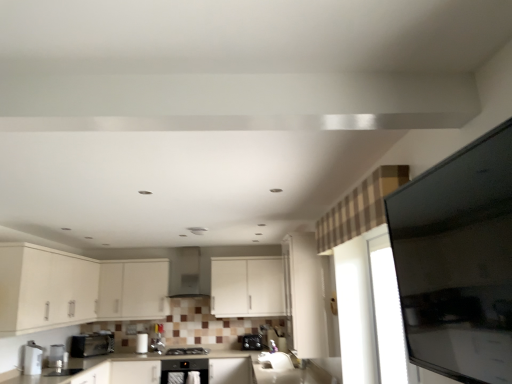
Where is `satin silver toaster at center, acting as the fifth appliance starting from the front`? The image size is (512, 384). satin silver toaster at center, acting as the fifth appliance starting from the front is located at coordinates (276, 338).

Based on the photo, measure the distance between satin black microwave at lower left, the first home appliance when ordered from left to right, and camera.

The distance of satin black microwave at lower left, the first home appliance when ordered from left to right, from camera is 5.02 meters.

Locate an element on the screen. The height and width of the screenshot is (384, 512). matte white cabinet at center, which is the second cabinetry from left to right is located at coordinates pos(133,289).

Which is closer to the camera, (379,268) or (186,359)?

Point (379,268) is positioned closer to the camera compared to point (186,359).

How far apart are transparent glass door at right and satin black oven at center, which is the first home appliance from right to left?

3.32 meters.

From a real-world perspective, is transparent glass door at right positioned above or below satin black oven at center, which is the first home appliance from right to left?

transparent glass door at right is above satin black oven at center, which is the first home appliance from right to left.

Is transparent glass door at right turned away from satin black oven at center, placed as the second home appliance when sorted from top to bottom?

No, transparent glass door at right's orientation is not away from satin black oven at center, placed as the second home appliance when sorted from top to bottom.

Based on their sizes in the image, would you say white matte cabinet at center, marked as the first cabinetry in a right-to-left arrangement, is bigger or smaller than transparent glass door at right?

In the image, white matte cabinet at center, marked as the first cabinetry in a right-to-left arrangement, appears to be larger than transparent glass door at right.

Would you say white matte cabinet at center, marked as the first cabinetry in a right-to-left arrangement, is inside or outside transparent glass door at right?

white matte cabinet at center, marked as the first cabinetry in a right-to-left arrangement, cannot be found inside transparent glass door at right.

Considering the positions of objects white matte cabinet at center, which appears as the third cabinetry when viewed from the left, and transparent glass door at right in the image provided, who is more to the right, white matte cabinet at center, which appears as the third cabinetry when viewed from the left, or transparent glass door at right?

From the viewer's perspective, transparent glass door at right appears more on the right side.

From a real-world perspective, between satin black stove at center and satin silver toaster at center, acting as the fifth appliance starting from the front, who is vertically lower?

From a 3D spatial view, satin black stove at center is below.

I want to click on the 3rd appliance located above the satin black stove at center (from a real-world perspective), so click(x=276, y=338).

Does satin black stove at center contain satin silver toaster at center, acting as the fifth appliance starting from the front?

No, satin silver toaster at center, acting as the fifth appliance starting from the front, is not inside satin black stove at center.

Could you tell me if satin black stove at center is facing satin silver toaster at center, acting as the fifth appliance starting from the front?

No, satin black stove at center does not turn towards satin silver toaster at center, acting as the fifth appliance starting from the front.

Who is bigger, satin black stove at center or satin black microwave at lower left, the first home appliance when ordered from left to right?

satin black microwave at lower left, the first home appliance when ordered from left to right.

In the scene shown: How distant is satin black stove at center from satin black microwave at lower left, the first home appliance when ordered from left to right?

The distance of satin black stove at center from satin black microwave at lower left, the first home appliance when ordered from left to right, is 3.36 feet.

Is satin black microwave at lower left, which ranks as the 2th home appliance in right-to-left order, inside satin black stove at center?

No, satin black microwave at lower left, which ranks as the 2th home appliance in right-to-left order, is located outside of satin black stove at center.

From a real-world perspective, between satin black stove at center and satin black microwave at lower left, which ranks as the 2th home appliance in right-to-left order, who is vertically lower?

In real-world perspective, satin black stove at center is lower.

From a real-world perspective, does satin black toaster at lower center, which is the 2th appliance in back-to-front order, stand above satin black oven at center, placed as the second home appliance when sorted from top to bottom?

Yes, from a real-world perspective, satin black toaster at lower center, which is the 2th appliance in back-to-front order, is on top of satin black oven at center, placed as the second home appliance when sorted from top to bottom.

Is point (251, 341) less distant than point (186, 359)?

No, it is behind (186, 359).

Does satin black toaster at lower center, which is the 2th appliance from right to left, turn towards satin black oven at center, placed as the second home appliance when sorted from top to bottom?

No, satin black toaster at lower center, which is the 2th appliance from right to left, is not turned towards satin black oven at center, placed as the second home appliance when sorted from top to bottom.

Is transparent glass door at right inside satin silver faucet at lower left, the first appliance in the left-to-right sequence?

No, satin silver faucet at lower left, the first appliance in the left-to-right sequence, does not contain transparent glass door at right.

Considering the positions of objects satin silver faucet at lower left, the fifth appliance positioned from the right, and transparent glass door at right in the image provided, who is more to the left, satin silver faucet at lower left, the fifth appliance positioned from the right, or transparent glass door at right?

From the viewer's perspective, satin silver faucet at lower left, the fifth appliance positioned from the right, appears more on the left side.

From the image's perspective, is satin silver faucet at lower left, the first appliance when ordered from front to back, under transparent glass door at right?

Yes, from the image's perspective, satin silver faucet at lower left, the first appliance when ordered from front to back, is below transparent glass door at right.

Does point (27, 373) come farther from viewer compared to point (383, 307)?

Yes, it is.

Do you think matte white cabinets at lower left, acting as the first cabinetry starting from the left, is within satin silver exhaust hood at center, or outside of it?

matte white cabinets at lower left, acting as the first cabinetry starting from the left, is located beyond the bounds of satin silver exhaust hood at center.

Is the surface of matte white cabinets at lower left, the third cabinetry when ordered from right to left, in direct contact with satin silver exhaust hood at center?

matte white cabinets at lower left, the third cabinetry when ordered from right to left, and satin silver exhaust hood at center are not in contact.

From a real-world perspective, who is located higher, matte white cabinets at lower left, the third cabinetry when ordered from right to left, or satin silver exhaust hood at center?

satin silver exhaust hood at center.

Image resolution: width=512 pixels, height=384 pixels. In order to click on glass door in front of the satin black oven at center, which is the first home appliance from right to left in this screenshot , I will do `click(387, 313)`.

There is a transparent glass door at right. At what (x,y) coordinates should I click in order to perform the action: click on the 2nd cabinetry below it (from the image's perspective). Please return your answer as a coordinate pair (x, y). The image size is (512, 384). Looking at the image, I should click on (247, 287).

Which object lies further to the anchor point metallic silver toaster at lower left, the 4th appliance viewed from the right, white matte cabinet at center, marked as the first cabinetry in a right-to-left arrangement, or matte white cabinet at center, which is the second cabinetry from left to right?

white matte cabinet at center, marked as the first cabinetry in a right-to-left arrangement.

From the image, which object appears to be nearer to satin black microwave at lower left, the first home appliance when ordered from top to bottom, metallic silver toaster at lower left, the 4th appliance viewed from the right, or matte white cabinet at center, which is the second cabinetry from left to right?

Among the two, metallic silver toaster at lower left, the 4th appliance viewed from the right, is located nearer to satin black microwave at lower left, the first home appliance when ordered from top to bottom.

From the image, which object appears to be nearer to satin silver exhaust hood at center, satin black toaster at lower center, which is the 2th appliance in back-to-front order, or matte white cabinets at lower left, the third cabinetry when ordered from right to left?

satin black toaster at lower center, which is the 2th appliance in back-to-front order, lies closer to satin silver exhaust hood at center than the other object.

Which object lies nearer to the anchor point white glossy toaster at lower center, arranged as the third appliance when viewed from the back, satin black microwave at lower left, which ranks as the 2th home appliance in right-to-left order, or satin silver toaster at center, the fifth appliance from the left?

satin black microwave at lower left, which ranks as the 2th home appliance in right-to-left order, is positioned closer to the anchor white glossy toaster at lower center, arranged as the third appliance when viewed from the back.

Which object lies nearer to the anchor point matte white cabinet at center, which is the second cabinetry from left to right, satin silver toaster at center, the fifth appliance from the left, or satin black stove at center?

satin black stove at center is closer to matte white cabinet at center, which is the second cabinetry from left to right.

Looking at the image, which one is located closer to white glossy toaster at lower center, arranged as the third appliance when viewed from the back, matte white cabinet at center, which is the second cabinetry from left to right, or matte white cabinets at lower left, acting as the first cabinetry starting from the left?

matte white cabinet at center, which is the second cabinetry from left to right.

Considering their positions, is satin black stove at center positioned further to satin silver faucet at lower left, the fifth appliance positioned from the right, than satin black oven at center, which is the first home appliance in bottom-to-top order?

satin black stove at center is further to satin silver faucet at lower left, the fifth appliance positioned from the right.

Looking at the image, which one is located closer to satin silver exhaust hood at center, satin black oven at center, which is the first home appliance from right to left, or satin black microwave at lower left, which ranks as the 2th home appliance in right-to-left order?

Based on the image, satin black oven at center, which is the first home appliance from right to left, appears to be nearer to satin silver exhaust hood at center.

Identify the location of exhaust hood between satin silver faucet at lower left, the first appliance in the left-to-right sequence, and transparent glass door at right, in the horizontal direction. The image size is (512, 384). (186, 273).

Where is `home appliance situated between satin black microwave at lower left, which is counted as the second home appliance, starting from the bottom, and satin silver toaster at center, acting as the fifth appliance starting from the front, from left to right`? home appliance situated between satin black microwave at lower left, which is counted as the second home appliance, starting from the bottom, and satin silver toaster at center, acting as the fifth appliance starting from the front, from left to right is located at coordinates (184, 370).

Find the location of a particular element. cabinetry located between transparent glass door at right and satin silver exhaust hood at center in the depth direction is located at coordinates (75, 289).

Image resolution: width=512 pixels, height=384 pixels. Find the location of `cabinetry between white glossy countertop at lower center and satin black oven at center, which is the first home appliance from right to left, from front to back`. cabinetry between white glossy countertop at lower center and satin black oven at center, which is the first home appliance from right to left, from front to back is located at coordinates (75, 289).